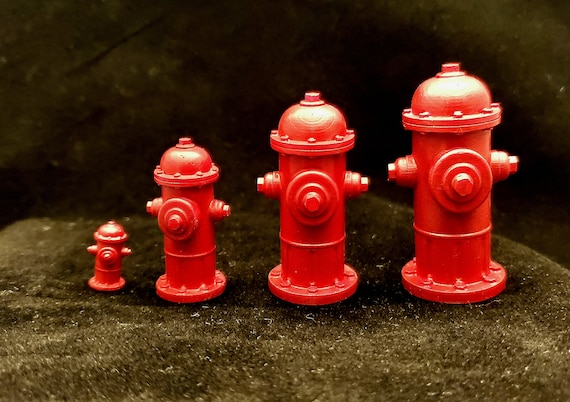
Locate an element on the screen. The width and height of the screenshot is (570, 402). crack in a surface is located at coordinates (129, 36).